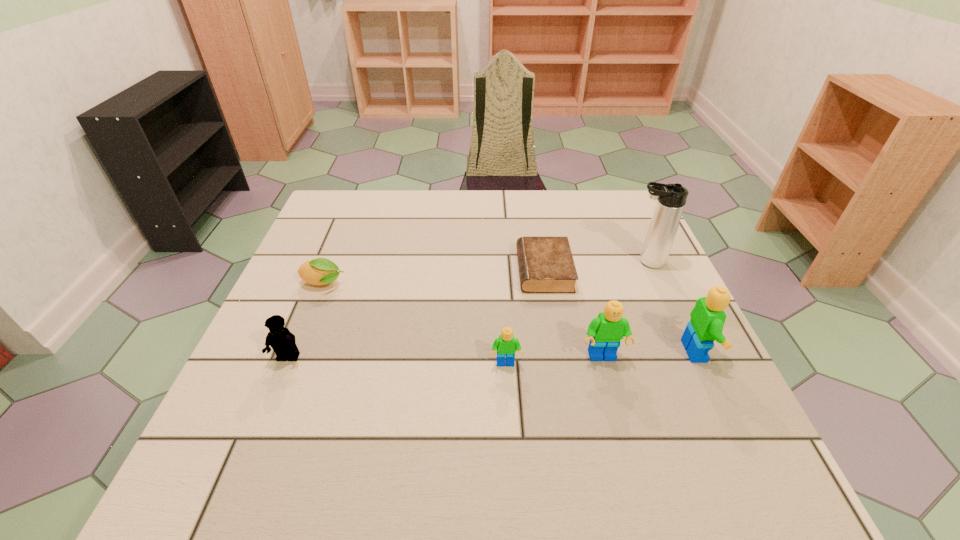
Identify the location of free spot located with leaves positioned above the lemon. This screenshot has width=960, height=540. (490, 284).

Identify the location of vacant space situated on the spine side of the shortest object. (411, 271).

The height and width of the screenshot is (540, 960). In order to click on vacant space located 0.210m on the spine side of the shortest object in this screenshot , I will do `click(435, 271)`.

The height and width of the screenshot is (540, 960). Find the location of `vacant space located 0.090m on the spine side of the shortest object`. vacant space located 0.090m on the spine side of the shortest object is located at coordinates tap(482, 271).

Where is `free space located 0.050m on the handle side of the thermos bottle`? This screenshot has width=960, height=540. free space located 0.050m on the handle side of the thermos bottle is located at coordinates (608, 262).

Locate an element on the screen. Image resolution: width=960 pixels, height=540 pixels. vacant space situated 0.200m on the handle side of the thermos bottle is located at coordinates (550, 262).

This screenshot has width=960, height=540. I want to click on free spot located 0.180m on the handle side of the thermos bottle, so coord(558,262).

The width and height of the screenshot is (960, 540). I want to click on lemon at the left edge, so click(x=320, y=271).

Identify the location of Lego located at the left edge. This screenshot has width=960, height=540. (282, 341).

At what (x,y) coordinates should I click in order to perform the action: click on Lego present at the right edge. Please return your answer as a coordinate pair (x, y). The image size is (960, 540). Looking at the image, I should click on (707, 320).